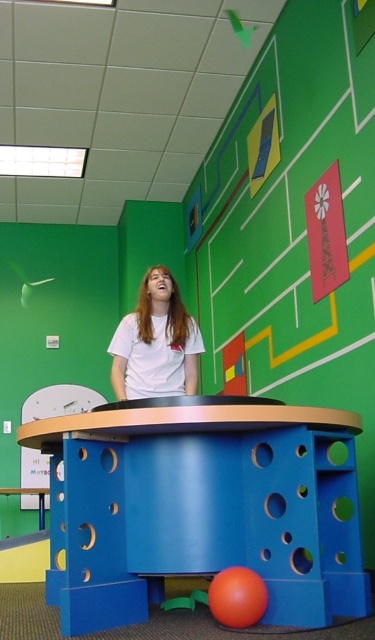
You are organizing a classroom and need to place a new poster. The poster is slightly larger than the white matte shirt at center. Can the blue matte table at center accommodate the poster without it hanging over the edges?

The blue matte table at center is bigger than the white matte shirt at center, so the poster, which is slightly larger than the white matte shirt at center, should fit on the blue matte table at center without hanging over the edges.

You are a teacher in a classroom and want to hang a new poster. You see the matte green bulletin board at upper center and the white matte shirt at center. Which object is bigger so you can choose the best place to hang the poster?

The matte green bulletin board at upper center is larger in size than the white matte shirt at center, so you should choose the matte green bulletin board at upper center to hang the poster since it has more space.

You are an interior designer assessing the classroom layout. You notice the matte green bulletin board at upper center and the white matte shirt at center. Which object has a greater width?

The matte green bulletin board at upper center has a greater width than the white matte shirt at center.